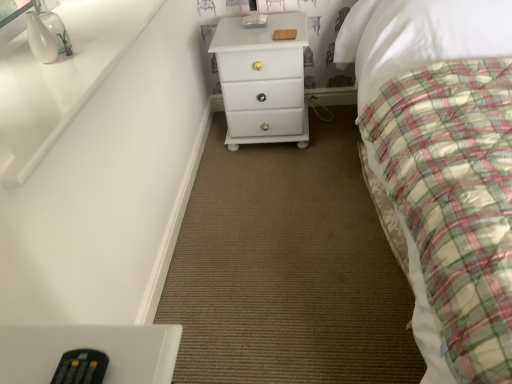
Question: Is white glossy chest of drawers at center at the back of plaid fabric bed at right?

Choices:
 (A) yes
 (B) no

Answer: (B)

Question: Does plaid fabric bed at right have a lesser height compared to white glossy chest of drawers at center?

Choices:
 (A) yes
 (B) no

Answer: (B)

Question: Can you confirm if plaid fabric bed at right is thinner than white glossy chest of drawers at center?

Choices:
 (A) yes
 (B) no

Answer: (B)

Question: Is plaid fabric bed at right taller than white glossy chest of drawers at center?

Choices:
 (A) yes
 (B) no

Answer: (A)

Question: From the image's perspective, is plaid fabric bed at right above white glossy chest of drawers at center?

Choices:
 (A) yes
 (B) no

Answer: (B)

Question: Could you tell me if plaid fabric bed at right is facing white glossy chest of drawers at center?

Choices:
 (A) no
 (B) yes

Answer: (A)

Question: Is black plastic remote at lower left thinner than plaid fabric bed at right?

Choices:
 (A) yes
 (B) no

Answer: (A)

Question: Can you confirm if black plastic remote at lower left is bigger than plaid fabric bed at right?

Choices:
 (A) yes
 (B) no

Answer: (B)

Question: Is black plastic remote at lower left wider than plaid fabric bed at right?

Choices:
 (A) yes
 (B) no

Answer: (B)

Question: Considering the relative sizes of black plastic remote at lower left and plaid fabric bed at right in the image provided, is black plastic remote at lower left shorter than plaid fabric bed at right?

Choices:
 (A) no
 (B) yes

Answer: (B)

Question: From a real-world perspective, is black plastic remote at lower left located higher than plaid fabric bed at right?

Choices:
 (A) yes
 (B) no

Answer: (A)

Question: Is plaid fabric bed at right completely or partially inside black plastic remote at lower left?

Choices:
 (A) yes
 (B) no

Answer: (B)

Question: Is white glossy chest of drawers at center to the right of plaid fabric bed at right from the viewer's perspective?

Choices:
 (A) no
 (B) yes

Answer: (A)